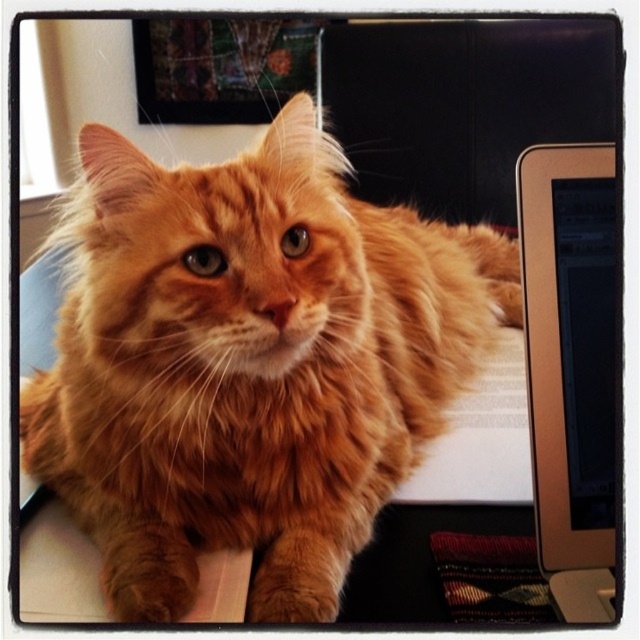
You are trying to determine if the orange fluffy cat at center can jump onto the metallic silver monitor at right. Based on their sizes, is this physically possible?

The orange fluffy cat at center is taller than the metallic silver monitor at right, so it has the capability to jump onto it.

Consider the image. You are trying to decide if the orange fluffy cat at center can fit on the desk where the metallic silver monitor at right is placed. Based on their sizes, can the cat fit on the desk along with the monitor?

The orange fluffy cat at center is bigger than the metallic silver monitor at right. Since the cat is larger, it might not leave enough space for both to be on the desk comfortably, so the cat may not fit alongside the monitor.